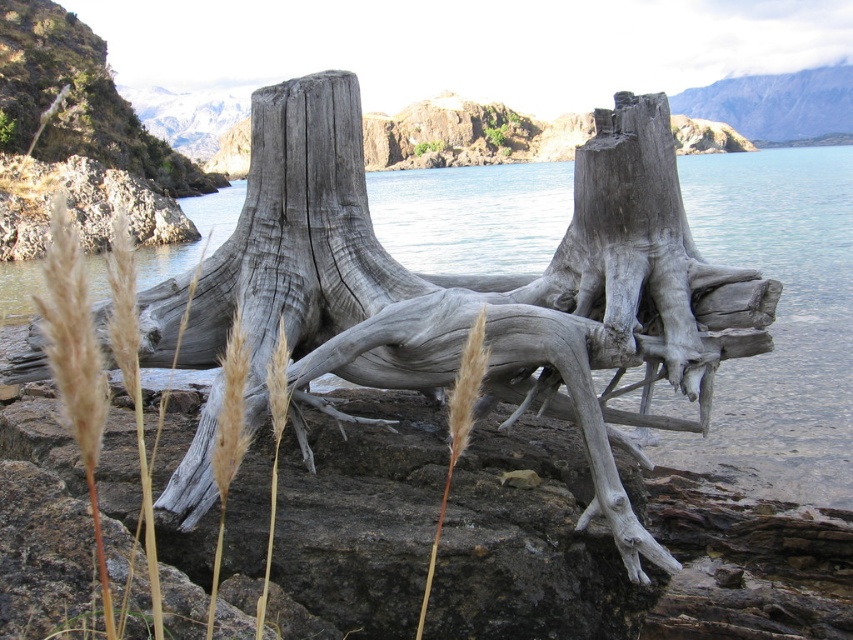
You are standing on the rocky shoreline and see the brown fuzzy grass at center and the clear blue water at center. Which one is positioned to the right side from your perspective?

The clear blue water at center is to the right of the brown fuzzy grass at center.

You are standing on the rocky shoreline and want to place a small statue exactly between the clear blue water at center and the brown fuzzy grass at center. Which object will the statue be closer to? Please explain your reasoning based on their relative heights.

The statue will be closer to the brown fuzzy grass at center because the clear blue water at center is much taller than the brown fuzzy grass at center. Since the statue is placed exactly between them, the vertical distance from the statue to the taller water would be greater than to the shorter grass.